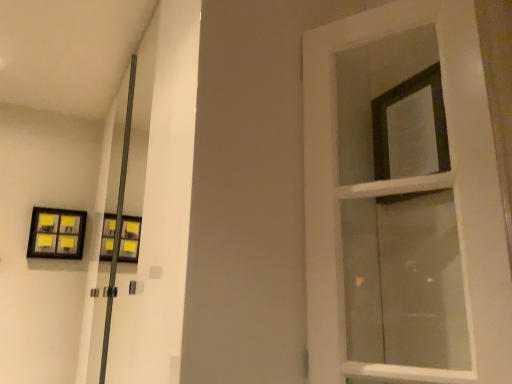
Measure the distance between white wooden door at right and camera.

white wooden door at right and camera are 83.67 centimeters apart.

The width and height of the screenshot is (512, 384). What do you see at coordinates (408, 190) in the screenshot?
I see `white wooden door at right` at bounding box center [408, 190].

The width and height of the screenshot is (512, 384). Find the location of `black matte frame at upper right`. black matte frame at upper right is located at coordinates (398, 101).

From a real-world perspective, which is physically above, matte black picture frame at upper left or black matte frame at upper right?

From a 3D spatial view, black matte frame at upper right is above.

Can you confirm if matte black picture frame at upper left is wider than black matte frame at upper right?

Indeed, matte black picture frame at upper left has a greater width compared to black matte frame at upper right.

Is matte black picture frame at upper left taller than black matte frame at upper right?

In fact, matte black picture frame at upper left may be shorter than black matte frame at upper right.

Are matte black picture frame at upper left and black matte frame at upper right located far from each other?

matte black picture frame at upper left is positioned a significant distance from black matte frame at upper right.

The height and width of the screenshot is (384, 512). What are the coordinates of `door on the left of black matte frame at upper right` in the screenshot? It's located at (408, 190).

From a real-world perspective, who is located higher, black matte frame at upper right or white wooden door at right?

black matte frame at upper right, from a real-world perspective.

Is black matte frame at upper right facing away from white wooden door at right?

That's not correct — black matte frame at upper right is not looking away from white wooden door at right.

Is matte black picture frame at upper left positioned before white wooden door at right?

No, it is not.

The height and width of the screenshot is (384, 512). Identify the location of door above the matte black picture frame at upper left (from the image's perspective). (408, 190).

Considering the relative sizes of matte black picture frame at upper left and white wooden door at right in the image provided, is matte black picture frame at upper left taller than white wooden door at right?

Incorrect, the height of matte black picture frame at upper left is not larger of that of white wooden door at right.

Which object is wider, matte black picture frame at upper left or white wooden door at right?

matte black picture frame at upper left is wider.

From the image's perspective, is white wooden door at right positioned above or below black matte frame at upper right?

Clearly, from the image's perspective, white wooden door at right is below black matte frame at upper right.

This screenshot has width=512, height=384. In order to click on door lying below the black matte frame at upper right (from the image's perspective) in this screenshot , I will do `click(408, 190)`.

Is white wooden door at right inside or outside of black matte frame at upper right?

white wooden door at right is not inside black matte frame at upper right, it's outside.

Is white wooden door at right inside the boundaries of matte black picture frame at upper left, or outside?

white wooden door at right is outside matte black picture frame at upper left.

The image size is (512, 384). I want to click on picture frame above the white wooden door at right (from a real-world perspective), so click(57, 234).

Can you confirm if white wooden door at right is wider than matte black picture frame at upper left?

In fact, white wooden door at right might be narrower than matte black picture frame at upper left.

Is matte black picture frame at upper left at the back of white wooden door at right?

No, white wooden door at right's orientation is not away from matte black picture frame at upper left.

From the picture: Is black matte frame at upper right turned away from matte black picture frame at upper left?

No, black matte frame at upper right is not facing the opposite direction of matte black picture frame at upper left.

At what (x,y) coordinates should I click in order to perform the action: click on window lying on the right of matte black picture frame at upper left. Please return your answer as a coordinate pair (x, y). This screenshot has height=384, width=512. Looking at the image, I should click on (398, 101).

Considering the points (445, 156) and (46, 225), which point is in front, point (445, 156) or point (46, 225)?

The point (445, 156) is in front.

Based on the photo, is black matte frame at upper right behind matte black picture frame at upper left?

No, the depth of black matte frame at upper right is less than that of matte black picture frame at upper left.

Locate an element on the screen. Image resolution: width=512 pixels, height=384 pixels. picture frame below the black matte frame at upper right (from the image's perspective) is located at coordinates (57, 234).

Identify the location of window lying on the right of white wooden door at right. This screenshot has width=512, height=384. (398, 101).

Considering their positions, is white wooden door at right positioned further to black matte frame at upper right than matte black picture frame at upper left?

Based on the image, matte black picture frame at upper left appears to be further to black matte frame at upper right.

Considering their positions, is black matte frame at upper right positioned further to matte black picture frame at upper left than white wooden door at right?

The object further to matte black picture frame at upper left is black matte frame at upper right.

Considering their positions, is matte black picture frame at upper left positioned further to black matte frame at upper right than white wooden door at right?

matte black picture frame at upper left.

From the image, which object appears to be nearer to matte black picture frame at upper left, white wooden door at right or black matte frame at upper right?

white wooden door at right lies closer to matte black picture frame at upper left than the other object.

Based on their spatial positions, is matte black picture frame at upper left or black matte frame at upper right further from white wooden door at right?

Among the two, matte black picture frame at upper left is located further to white wooden door at right.

Which object lies nearer to the anchor point white wooden door at right, black matte frame at upper right or matte black picture frame at upper left?

The object closer to white wooden door at right is black matte frame at upper right.

Find the location of a particular element. The image size is (512, 384). window between white wooden door at right and matte black picture frame at upper left in the front-back direction is located at coordinates (398, 101).